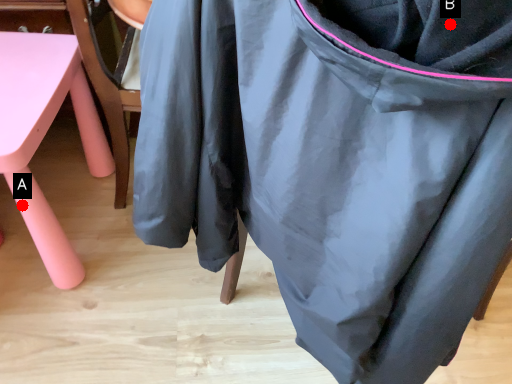
Question: Two points are circled on the image, labeled by A and B beside each circle. Which point is closer to the camera?

Choices:
 (A) A is closer
 (B) B is closer

Answer: (B)